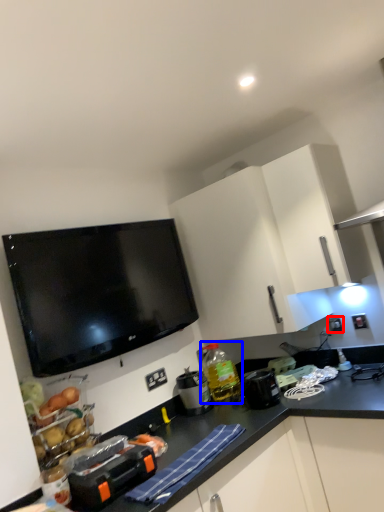
Question: Which object is closer to the camera taking this photo, electric outlet (highlighted by a red box) or bottle (highlighted by a blue box)?

Choices:
 (A) electric outlet
 (B) bottle

Answer: (B)